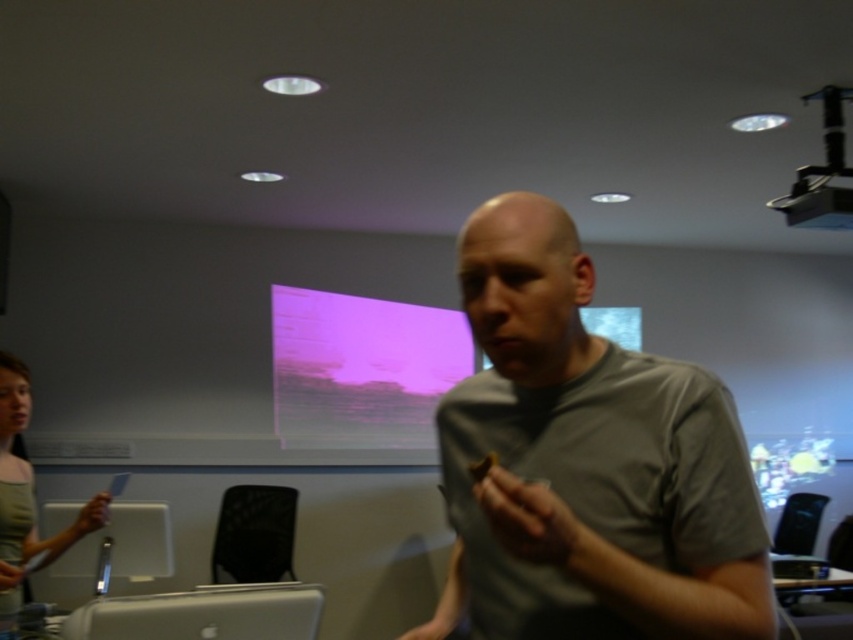
Is gray matte shirt at center wider than purple matte projection screen at upper center?

Incorrect, gray matte shirt at center's width does not surpass purple matte projection screen at upper center's.

Looking at this image, is gray matte shirt at center above purple matte projection screen at upper center?

Yes, gray matte shirt at center is above purple matte projection screen at upper center.

Who is more distant from viewer, (583, 566) or (412, 420)?

Point (412, 420)

Identify the location of gray matte shirt at center. The image size is (853, 640). (585, 461).

Is point (433, 404) less distant than point (64, 630)?

No, it is behind (64, 630).

Which of these two, purple matte projection screen at upper center or silver metallic laptop at lower left, stands taller?

Standing taller between the two is purple matte projection screen at upper center.

Which is in front, point (427, 449) or point (171, 612)?

Point (171, 612)

At what (x,y) coordinates should I click in order to perform the action: click on purple matte projection screen at upper center. Please return your answer as a coordinate pair (x, y). Looking at the image, I should click on (361, 369).

Can you confirm if green fabric shirt at left is thinner than black plastic projector at upper right?

No, green fabric shirt at left is not thinner than black plastic projector at upper right.

Consider the image. Between green fabric shirt at left and black plastic projector at upper right, which one appears on the left side from the viewer's perspective?

green fabric shirt at left

At what (x,y) coordinates should I click in order to perform the action: click on green fabric shirt at left. Please return your answer as a coordinate pair (x, y). The height and width of the screenshot is (640, 853). Looking at the image, I should click on (26, 492).

Identify the location of green fabric shirt at left. (26, 492).